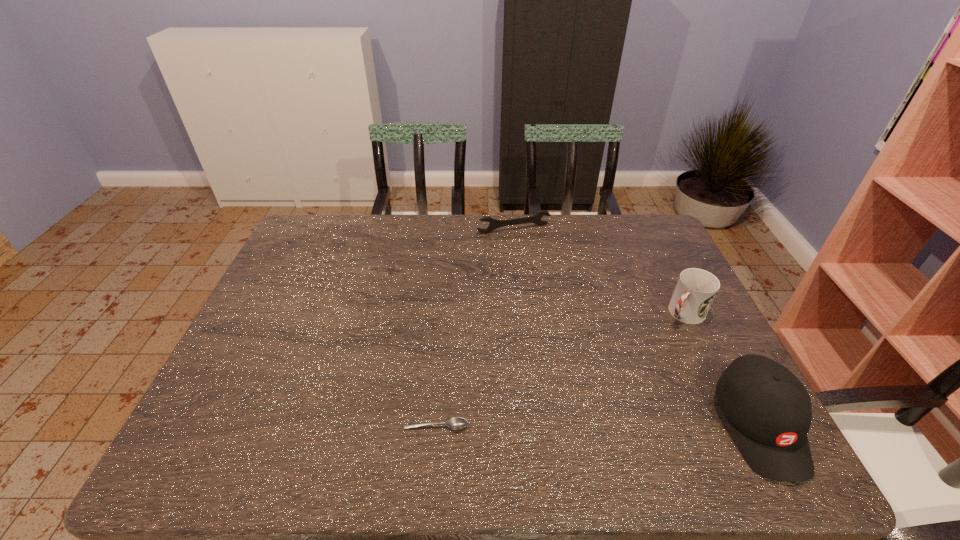
At what (x,y) coordinates should I click in order to perform the action: click on vacant space located on the open ends of the wrench. Please return your answer as a coordinate pair (x, y). Looking at the image, I should click on (558, 303).

Find the location of a particular element. The image size is (960, 540). vacant space located 0.190m on the open ends of the wrench is located at coordinates (540, 270).

You are a GUI agent. You are given a task and a screenshot of the screen. Output one action in this format:
    pyautogui.click(x=<x>, y=<y>)
    Task: Click on the vacant space located 0.200m on the open ends of the wrench
    This screenshot has height=540, width=960.
    Given the screenshot: What is the action you would take?
    pyautogui.click(x=541, y=272)

You are a GUI agent. You are given a task and a screenshot of the screen. Output one action in this format:
    pyautogui.click(x=<x>, y=<y>)
    Task: Click on the object that is at the far edge
    The height and width of the screenshot is (540, 960).
    Given the screenshot: What is the action you would take?
    tap(536, 219)

Where is `soupspoon that is at the near edge`? soupspoon that is at the near edge is located at coordinates (456, 423).

Locate an element on the screen. baseball cap situated at the near edge is located at coordinates 768,408.

Where is `baseball cap that is at the right edge`? Image resolution: width=960 pixels, height=540 pixels. baseball cap that is at the right edge is located at coordinates (768, 408).

Locate an element on the screen. The image size is (960, 540). cup that is at the right edge is located at coordinates click(x=695, y=291).

You are a GUI agent. You are given a task and a screenshot of the screen. Output one action in this format:
    pyautogui.click(x=<x>, y=<y>)
    Task: Click on the object that is positioned at the near right corner
    This screenshot has width=960, height=540.
    Given the screenshot: What is the action you would take?
    pyautogui.click(x=768, y=408)

Where is `free spot at the far edge of the desktop`? free spot at the far edge of the desktop is located at coordinates (564, 225).